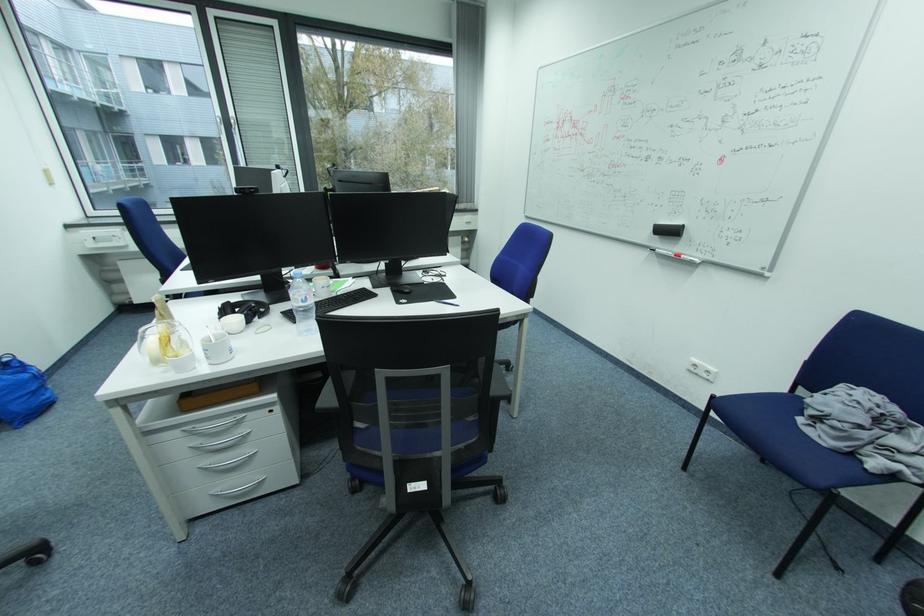
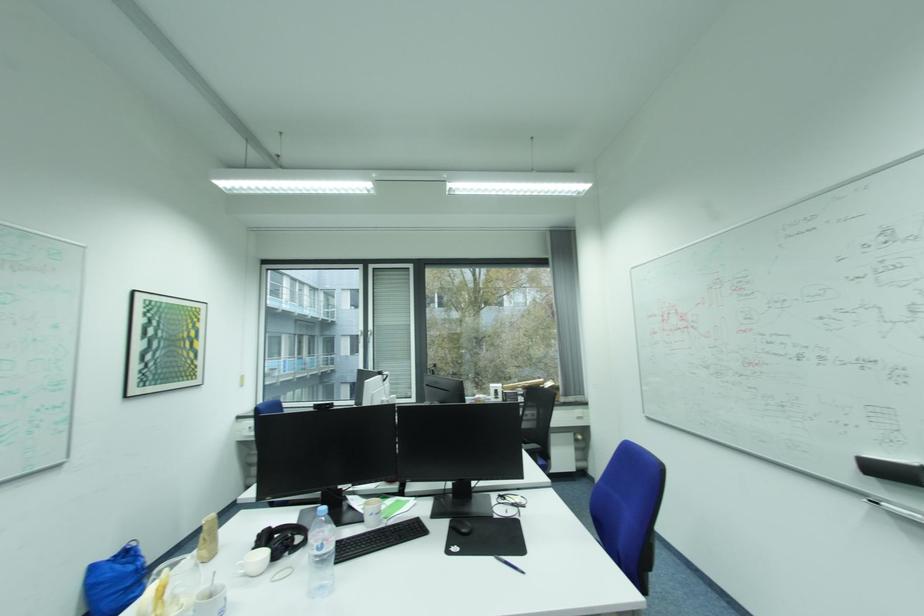
From the picture: First-person continuous shooting, in which direction is the camera rotating?

The rotation direction of the camera is left-up.